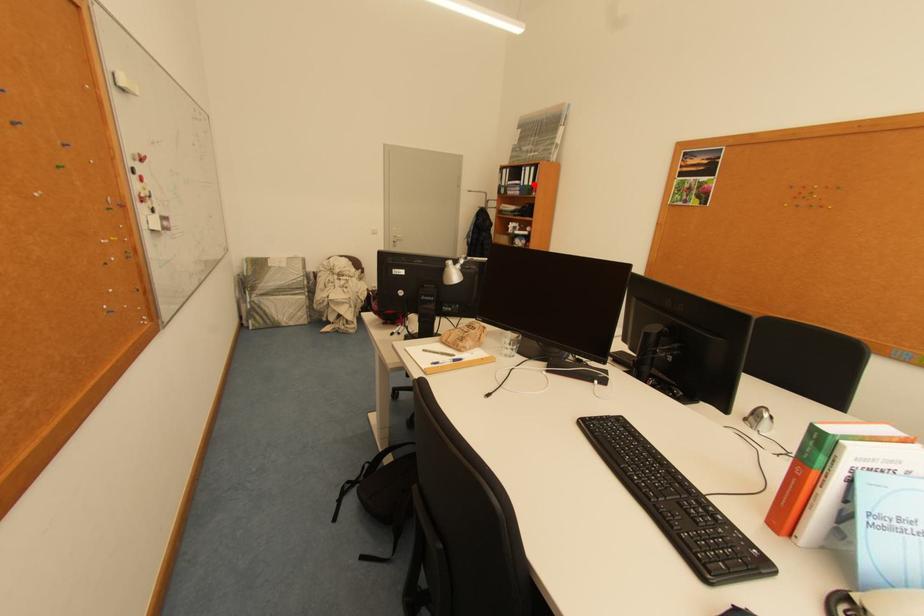
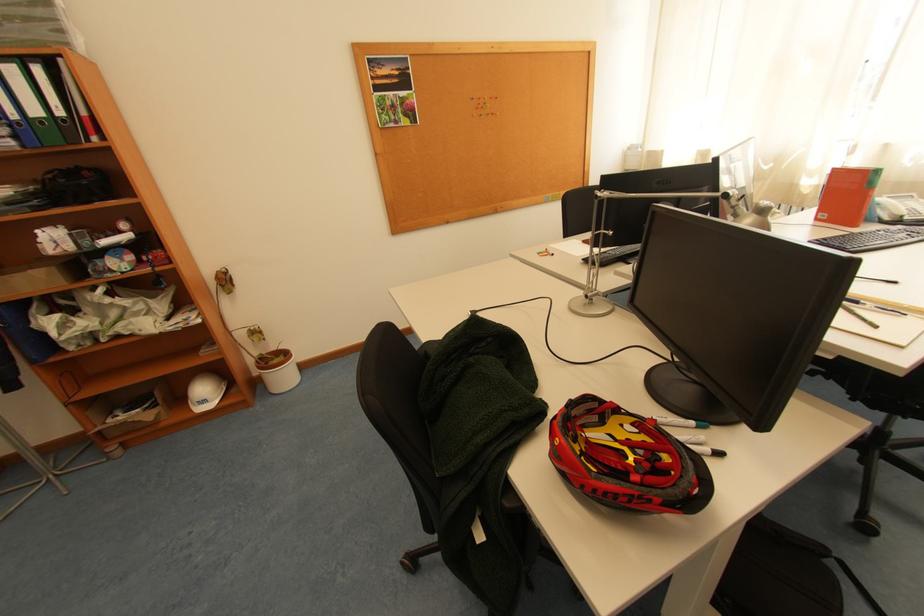
Question: I am providing you with two images of the same scene from different viewpoints. A red point is shown in image1. For the corresponding object point in image2, is it positioned nearer or farther from the camera?

Choices:
 (A) Nearer
 (B) Farther

Answer: (B)